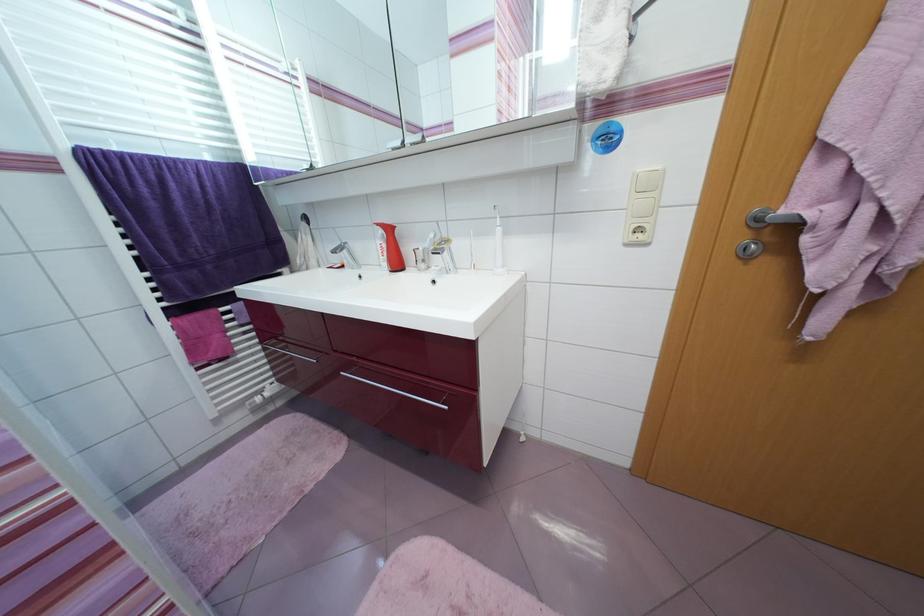
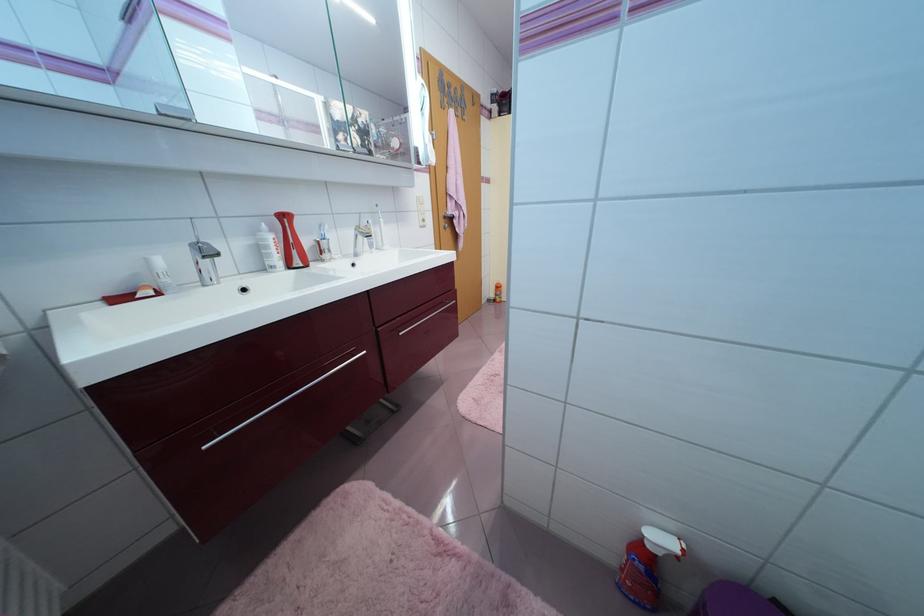
Question: I am providing you with two images of the same scene from different viewpoints. After the viewpoint changes to image2, which objects are now occluded?

Choices:
 (A) red toothbrush holder
 (B) mirror cabinet handle
 (C) white light switch
 (D) black board eraser

Answer: (C)